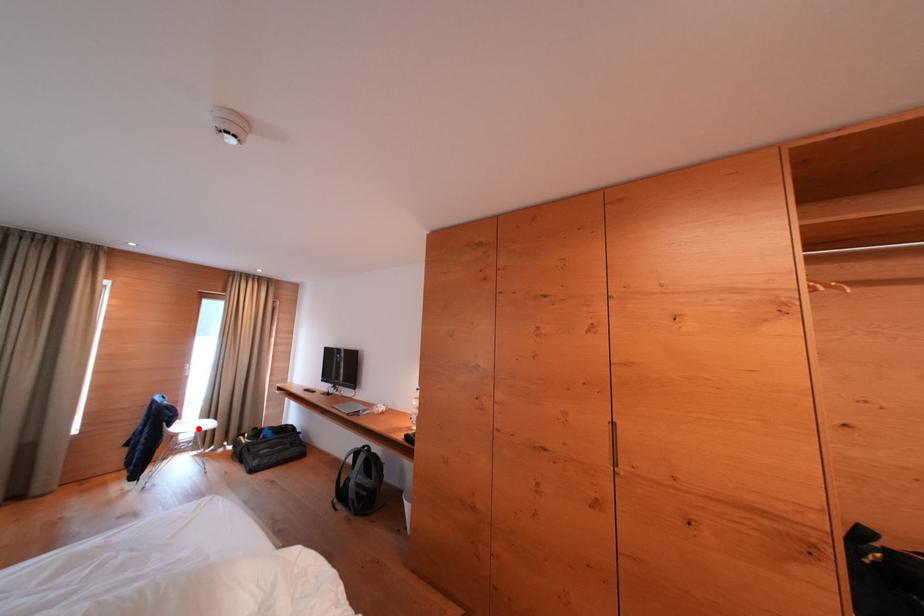
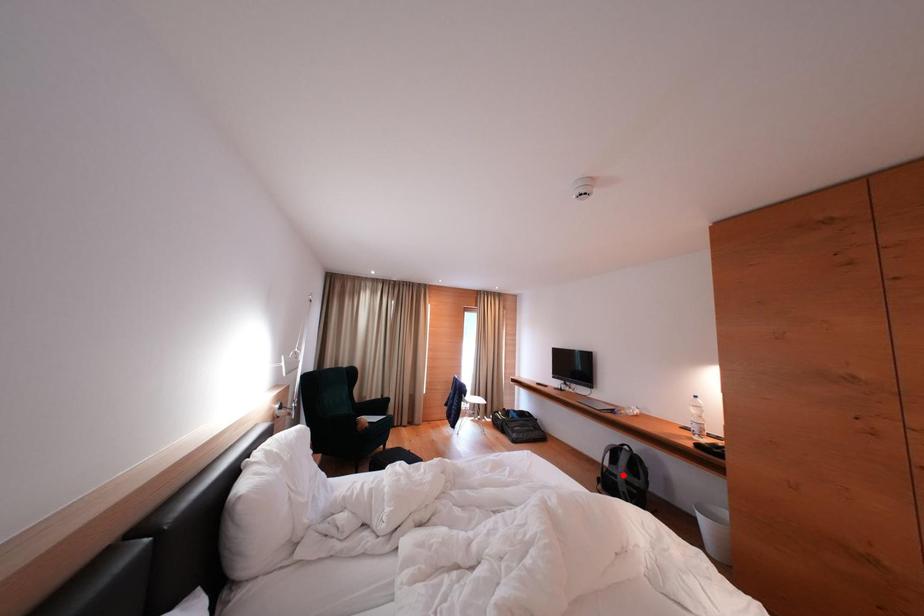
I am providing you with two images of the same scene from different viewpoints. A red point is marked on the first image and another point is marked on the second image. Does the point marked in image1 correspond to the same location as the one in image2?

No